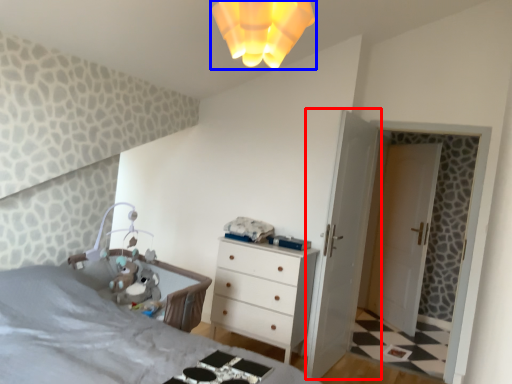
Question: Which object is closer to the camera taking this photo, door (highlighted by a red box) or light fixture (highlighted by a blue box)?

Choices:
 (A) door
 (B) light fixture

Answer: (B)